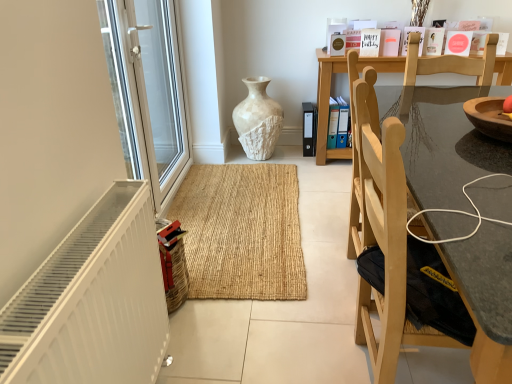
At what (x,y) coordinates should I click in order to perform the action: click on spots to the right of white textured vase at center. Please return your answer as a coordinate pair (x, y). Looking at the image, I should click on coord(301,158).